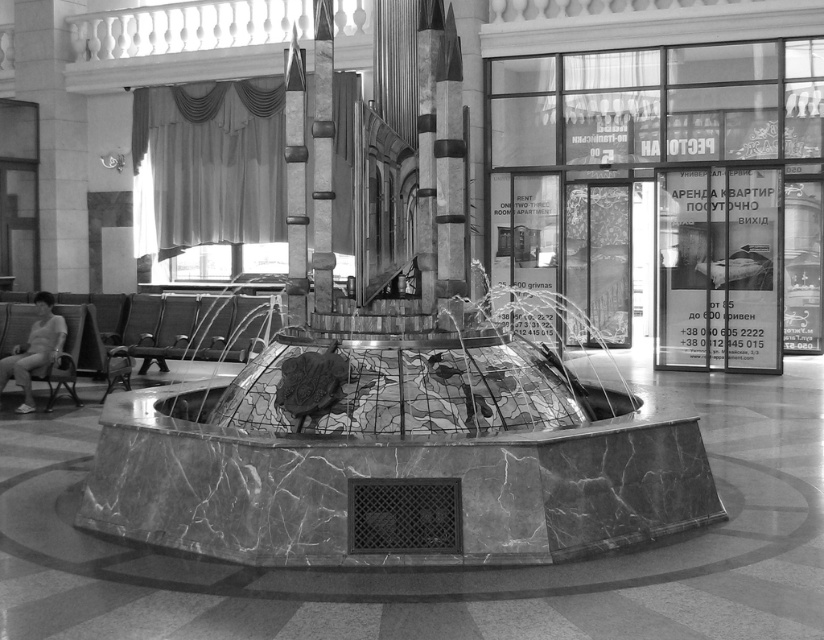
Question: Which object is farther from the camera taking this photo?

Choices:
 (A) marble pole at center
 (B) polished marble pole at center

Answer: (A)

Question: Can you confirm if polished marble pole at center is positioned to the right of marble pole at center?

Choices:
 (A) no
 (B) yes

Answer: (B)

Question: Where is polished marble pole at center located in relation to marble pole at center in the image?

Choices:
 (A) right
 (B) left

Answer: (A)

Question: Can you confirm if polished marble pole at center is positioned below marble pole at center?

Choices:
 (A) yes
 (B) no

Answer: (A)

Question: Which point is farther to the camera?

Choices:
 (A) polished marble pole at center
 (B) marble pole at center

Answer: (B)